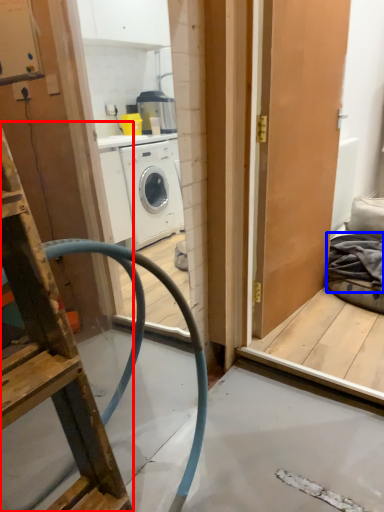
Question: Which object appears closest to the camera in this image, ladder (highlighted by a red box) or material (highlighted by a blue box)?

Choices:
 (A) ladder
 (B) material

Answer: (A)